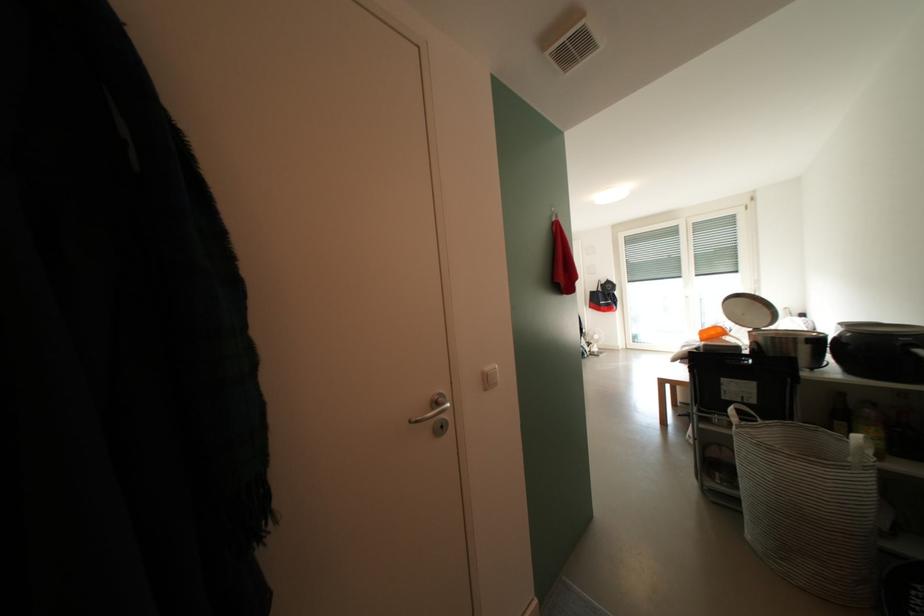
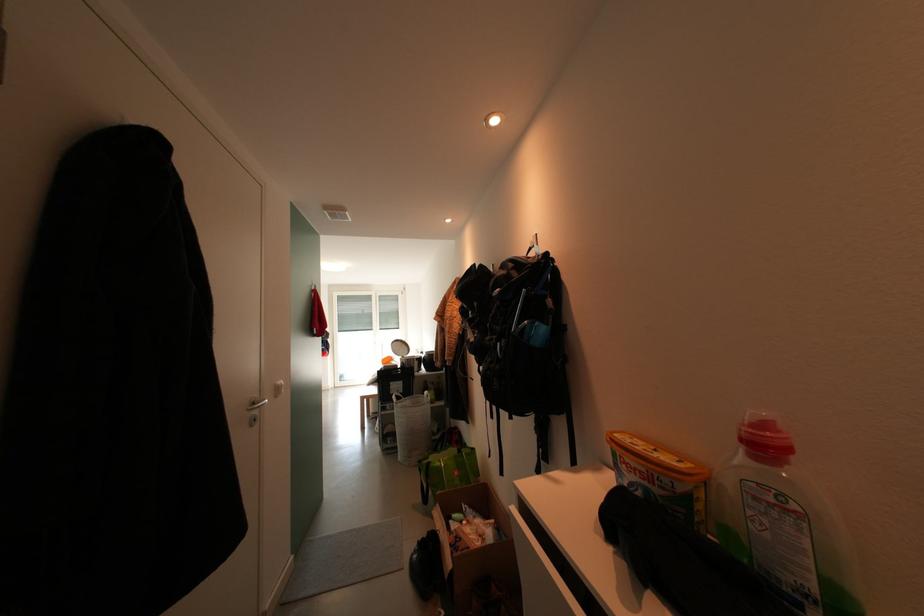
Question: I am providing you with two images of the same scene from different viewpoints. Please identify which objects are invisible in image2.

Choices:
 (A) orange detergent box
 (B) silver door handle
 (C) detergent bottle
 (D) none of these

Answer: (D)